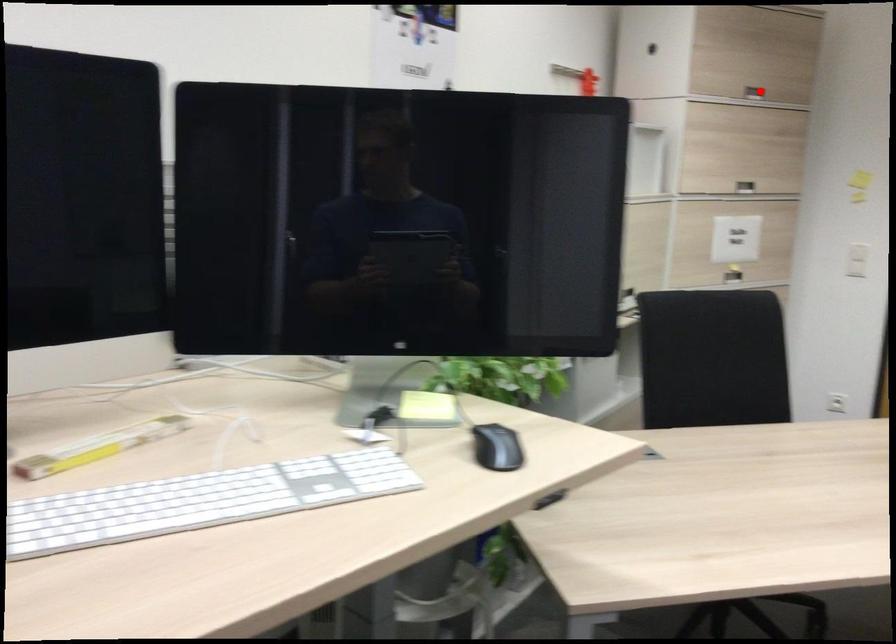
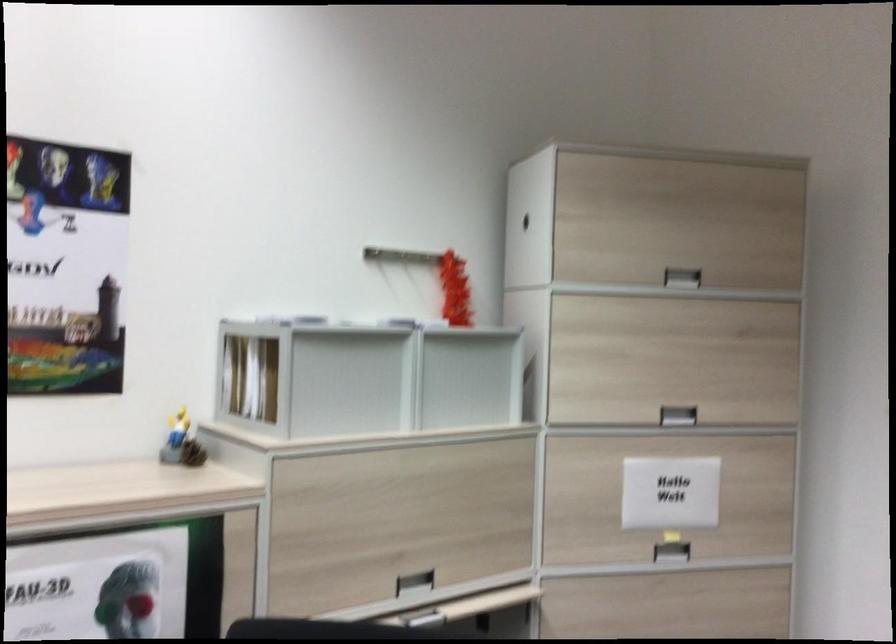
Find the pixel in the second image that matches the highlighted location in the first image.

(682, 277)